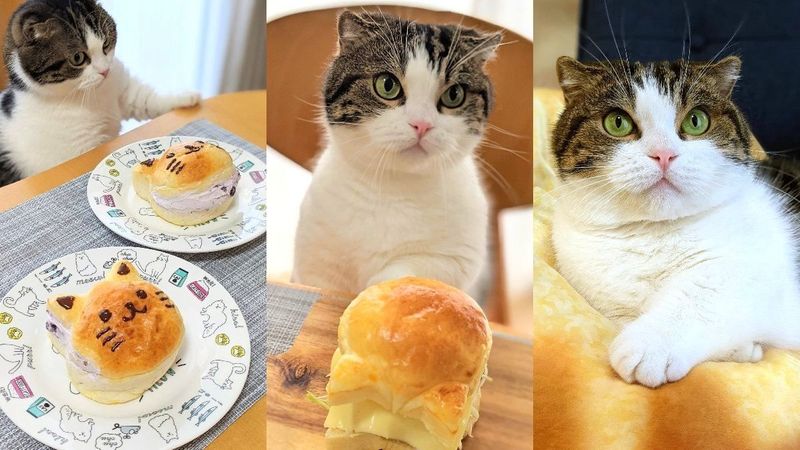
Find the location of `placemat`. placemat is located at coordinates (72, 218), (290, 317).